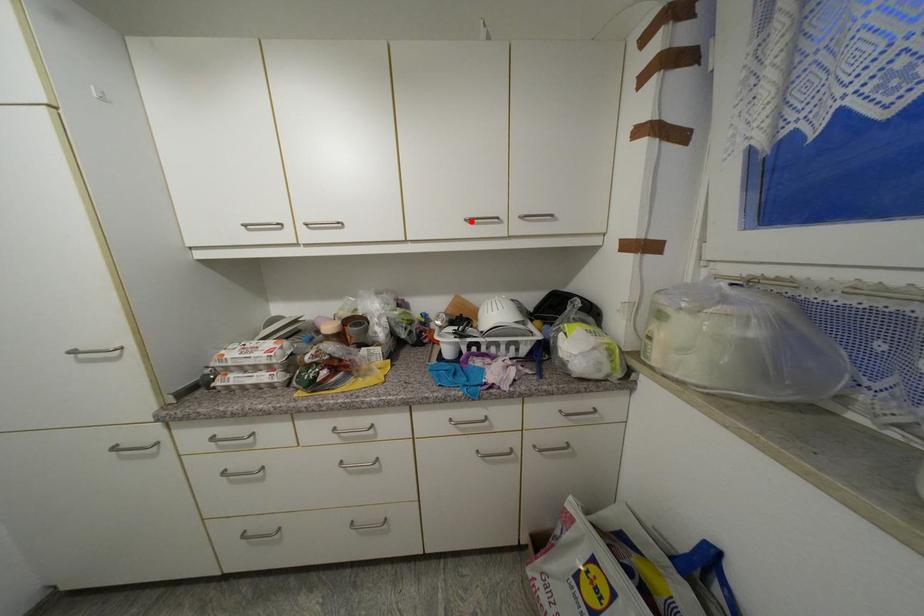
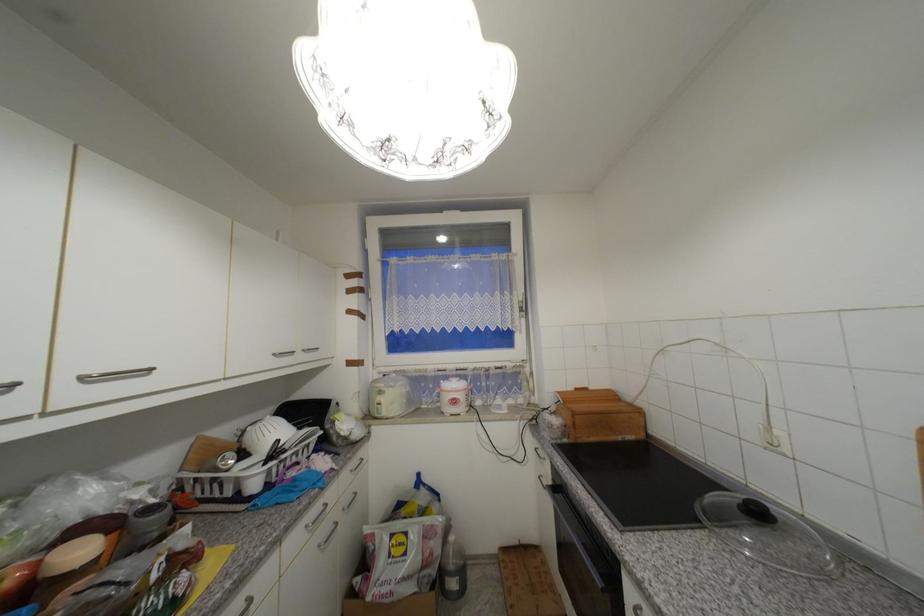
Locate, in the second image, the point that corresponds to the highlighted location in the first image.

(281, 355)